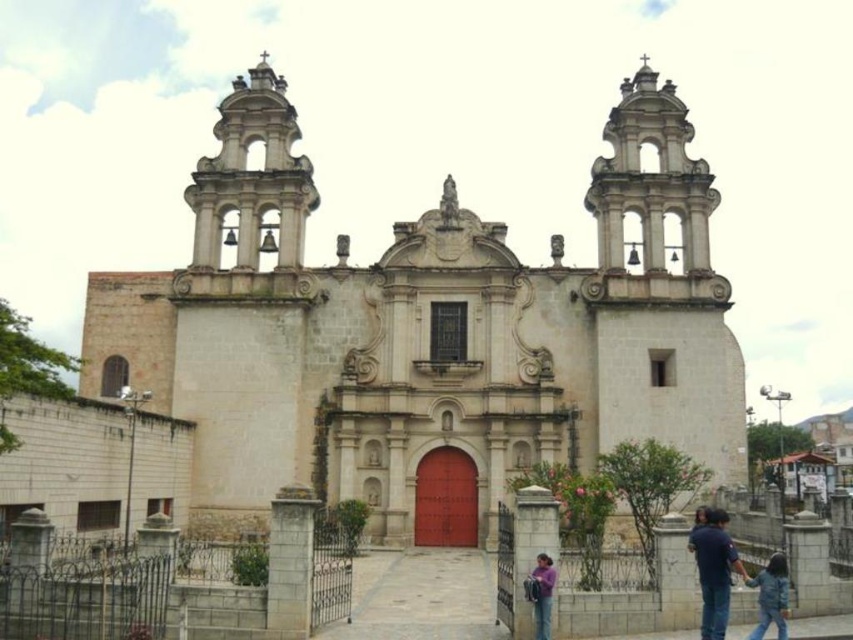
Does point (721, 612) come in front of point (549, 625)?

That is False.

Does blue jeans at lower right have a lesser height compared to purple cotton shirt at lower center?

No.

This screenshot has height=640, width=853. Describe the element at coordinates (714, 570) in the screenshot. I see `blue jeans at lower right` at that location.

Find the location of a particular element. The height and width of the screenshot is (640, 853). blue jeans at lower right is located at coordinates (714, 570).

Who is positioned more to the right, blue jeans at lower right or denim jacket at lower right?

Positioned to the right is denim jacket at lower right.

Which is in front, point (718, 552) or point (773, 618)?

Positioned in front is point (718, 552).

The height and width of the screenshot is (640, 853). Identify the location of blue jeans at lower right. (714, 570).

Can you confirm if denim jacket at lower right is wider than purple cotton shirt at lower center?

Yes.

Is the position of denim jacket at lower right more distant than that of purple cotton shirt at lower center?

Yes, it is.

Is point (757, 579) closer to viewer compared to point (535, 609)?

No, it is behind (535, 609).

Image resolution: width=853 pixels, height=640 pixels. Find the location of `denim jacket at lower right`. denim jacket at lower right is located at coordinates (770, 596).